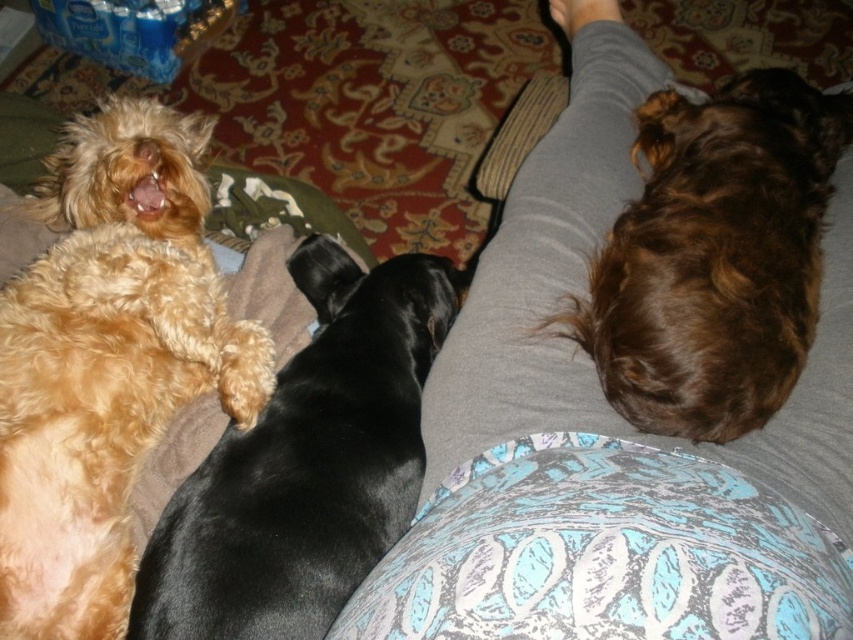
At what (x,y) coordinates should I click in order to perform the action: click on gray fabric at upper center. Please return your answer as a coordinate pair (x, y). The width and height of the screenshot is (853, 640). Looking at the image, I should click on (610, 433).

Can you confirm if gray fabric at upper center is bigger than golden fur dog at upper left?

Indeed, gray fabric at upper center has a larger size compared to golden fur dog at upper left.

What do you see at coordinates (610, 433) in the screenshot? I see `gray fabric at upper center` at bounding box center [610, 433].

This screenshot has height=640, width=853. Identify the location of gray fabric at upper center. (610, 433).

Is golden fur dog at upper left to the right of black shiny dog at center from the viewer's perspective?

Incorrect, golden fur dog at upper left is not on the right side of black shiny dog at center.

Who is positioned more to the left, golden fur dog at upper left or black shiny dog at center?

golden fur dog at upper left is more to the left.

Who is more distant from viewer, (213, 296) or (299, 257)?

The point (299, 257) is behind.

Locate an element on the screen. golden fur dog at upper left is located at coordinates (107, 362).

Does gray fabric at upper center appear under black shiny dog at center?

Actually, gray fabric at upper center is above black shiny dog at center.

Can you confirm if gray fabric at upper center is wider than black shiny dog at center?

Yes, gray fabric at upper center is wider than black shiny dog at center.

Which is behind, point (508, 230) or point (352, 572)?

Positioned behind is point (508, 230).

This screenshot has height=640, width=853. I want to click on gray fabric at upper center, so click(x=610, y=433).